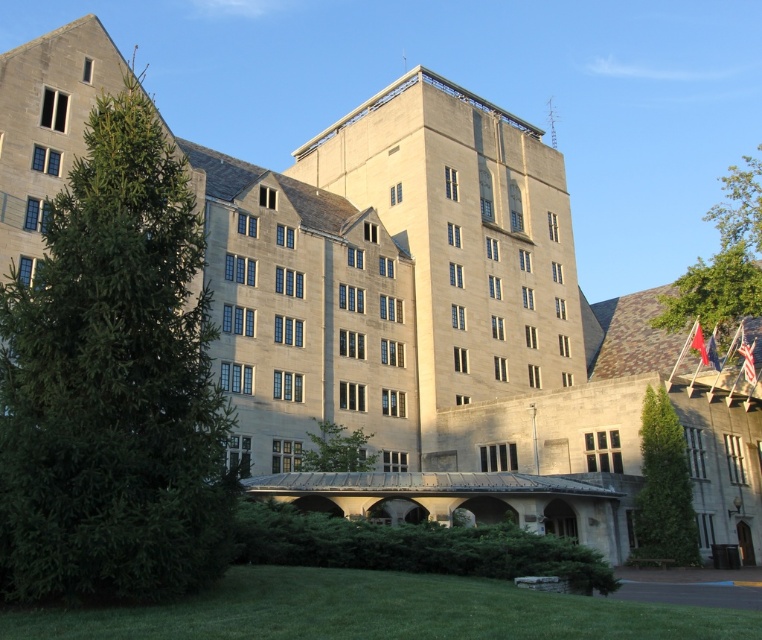
You are a landscape architect designing a walking path between the green grass at lower center and the green leafy tree at center. What is the minimum distance you need to plan for the path?

The minimum distance you need to plan for the path is 23.98 meters, as the green grass at lower center and green leafy tree at center are 23.98 meters apart.

You are standing at the point marked by the coordinates point (722, 260) in the image. What do you see directly in front of you?

The point (722, 260) indicates a green leafy tree at upper right, so you would see the green leafy tree at upper right directly in front of you.